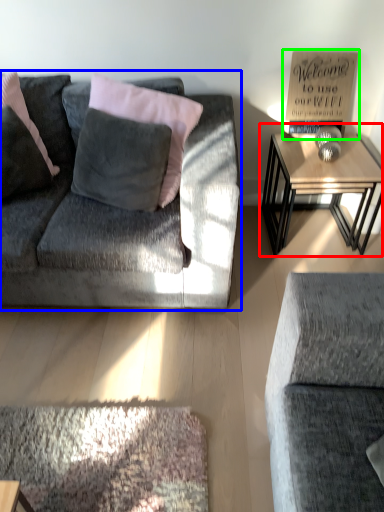
Question: Estimate the real-world distances between objects in this image. Which object is farther from table (highlighted by a red box), studio couch (highlighted by a blue box) or bulletin board (highlighted by a green box)?

Choices:
 (A) studio couch
 (B) bulletin board

Answer: (A)